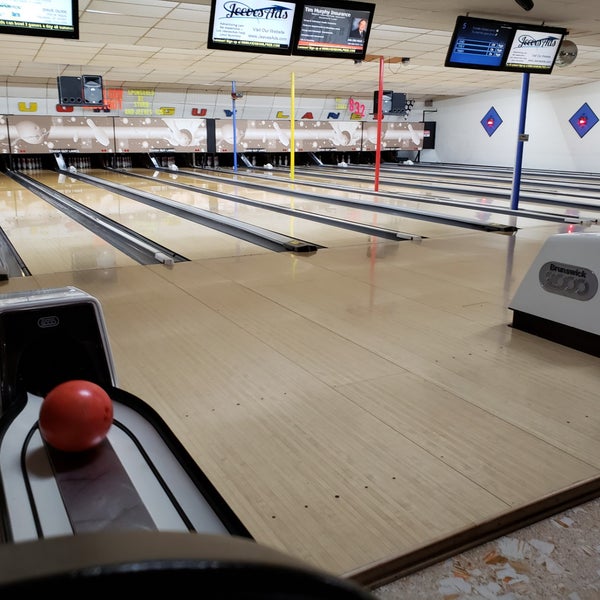
Identify the location of screens. (32, 16), (278, 25), (339, 28), (477, 38), (539, 47).